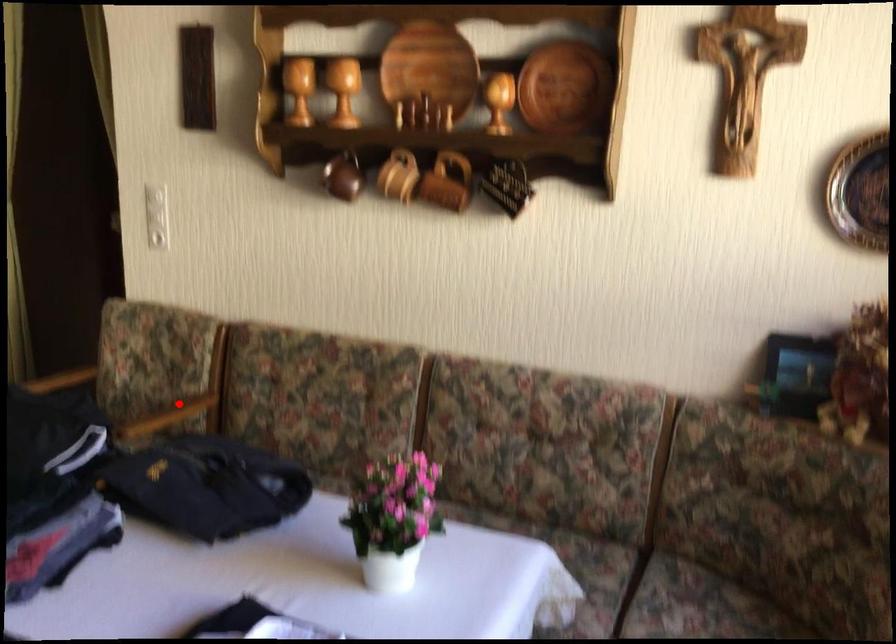
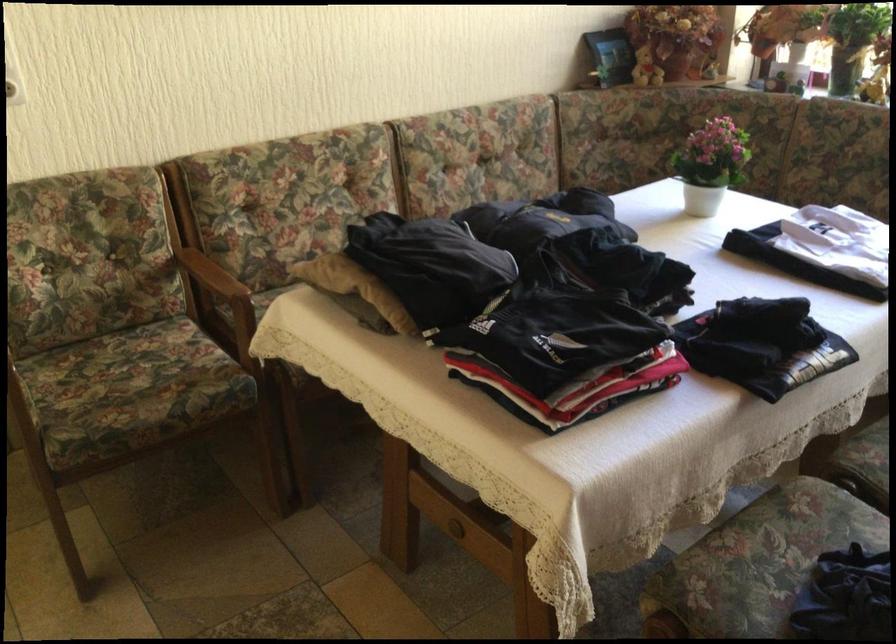
Question: I am providing you with two images of the same scene from different viewpoints. In image1, a red point is highlighted. Considering the same 3D point in image2, which of the following is correct?

Choices:
 (A) It is closer
 (B) It is farther

Answer: (A)